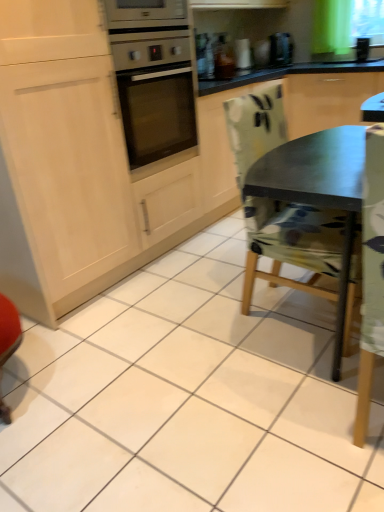
I want to click on camouflage fabric chair at center, so click(298, 199).

What is the approximate width of camouflage fabric chair at center?

camouflage fabric chair at center is 57.73 centimeters wide.

Describe the element at coordinates (242, 54) in the screenshot. The width and height of the screenshot is (384, 512). I see `metallic silver toaster at upper center` at that location.

Measure the distance between black plastic coffee machine at upper center and camera.

They are 3.31 meters apart.

At what (x,y) coordinates should I click in order to perform the action: click on camouflage fabric chair at center. Please return your answer as a coordinate pair (x, y). This screenshot has height=512, width=384. Looking at the image, I should click on (x=298, y=199).

Considering the relative sizes of camouflage fabric chair at center and metallic silver toaster at upper center in the image provided, is camouflage fabric chair at center wider than metallic silver toaster at upper center?

Correct, the width of camouflage fabric chair at center exceeds that of metallic silver toaster at upper center.

Is camouflage fabric chair at center turned away from metallic silver toaster at upper center?

No.

In the image, is camouflage fabric chair at center on the left side or the right side of metallic silver toaster at upper center?

camouflage fabric chair at center is to the right of metallic silver toaster at upper center.

Considering the relative sizes of black plastic coffee machine at upper center and metallic silver toaster at upper center in the image provided, is black plastic coffee machine at upper center thinner than metallic silver toaster at upper center?

No, black plastic coffee machine at upper center is not thinner than metallic silver toaster at upper center.

Find the location of `coffee machine located on the right of metallic silver toaster at upper center`. coffee machine located on the right of metallic silver toaster at upper center is located at coordinates (281, 49).

From a real-world perspective, which object stands above the other?

metallic silver toaster at upper center.

Image resolution: width=384 pixels, height=512 pixels. I want to click on appliance above the black plastic coffee machine at upper center (from a real-world perspective), so pos(242,54).

Which is correct: metallic silver toaster at upper center is inside black plastic coffee machine at upper center, or outside of it?

metallic silver toaster at upper center lies outside black plastic coffee machine at upper center.

Does metallic silver toaster at upper center touch black plastic coffee machine at upper center?

No, metallic silver toaster at upper center is not next to black plastic coffee machine at upper center.

What's the angular difference between metallic silver toaster at upper center and black plastic coffee machine at upper center's facing directions?

8.97 degrees separate the facing orientations of metallic silver toaster at upper center and black plastic coffee machine at upper center.

Does metallic silver toaster at upper center have a smaller size compared to camouflage fabric chair at center?

Correct, metallic silver toaster at upper center occupies less space than camouflage fabric chair at center.

Considering the relative positions of metallic silver toaster at upper center and camouflage fabric chair at center in the image provided, is metallic silver toaster at upper center to the right of camouflage fabric chair at center from the viewer's perspective?

No, metallic silver toaster at upper center is not to the right of camouflage fabric chair at center.

From the image's perspective, is metallic silver toaster at upper center over camouflage fabric chair at center?

Indeed, from the image's perspective, metallic silver toaster at upper center is shown above camouflage fabric chair at center.

Between point (249, 47) and point (242, 199), which one is positioned in front?

Point (242, 199)

Is point (290, 52) positioned after point (307, 154)?

Yes, point (290, 52) is farther from viewer.

Considering the relative sizes of black plastic coffee machine at upper center and camouflage fabric chair at center in the image provided, is black plastic coffee machine at upper center taller than camouflage fabric chair at center?

No.

Can you confirm if black plastic coffee machine at upper center is wider than camouflage fabric chair at center?

No, black plastic coffee machine at upper center is not wider than camouflage fabric chair at center.

Could you tell me if black plastic coffee machine at upper center is turned towards camouflage fabric chair at center?

No.

You are a GUI agent. You are given a task and a screenshot of the screen. Output one action in this format:
    pyautogui.click(x=<x>, y=<y>)
    Task: Click on the coffee machine positioned vertically above the camouflage fabric chair at center (from a real-world perspective)
    The height and width of the screenshot is (512, 384).
    Given the screenshot: What is the action you would take?
    pyautogui.click(x=281, y=49)

Can you see camouflage fabric chair at center touching black plastic coffee machine at upper center?

No, camouflage fabric chair at center is not beside black plastic coffee machine at upper center.

How much distance is there between camouflage fabric chair at center and black plastic coffee machine at upper center?

camouflage fabric chair at center is 2.11 meters from black plastic coffee machine at upper center.

Does camouflage fabric chair at center come behind black plastic coffee machine at upper center?

No, the depth of camouflage fabric chair at center is less than that of black plastic coffee machine at upper center.

Find the location of a particular element. This screenshot has width=384, height=512. appliance that is above the camouflage fabric chair at center (from a real-world perspective) is located at coordinates (242, 54).

In order to click on appliance above the black plastic coffee machine at upper center (from the image's perspective) in this screenshot , I will do `click(242, 54)`.

Based on their spatial positions, is metallic silver toaster at upper center or black plastic coffee machine at upper center further from camouflage fabric chair at center?

metallic silver toaster at upper center.

When comparing their distances from metallic silver toaster at upper center, does camouflage fabric chair at center or black plastic coffee machine at upper center seem further?

Among the two, camouflage fabric chair at center is located further to metallic silver toaster at upper center.

Based on their spatial positions, is black plastic coffee machine at upper center or metallic silver toaster at upper center further from camouflage fabric chair at center?

metallic silver toaster at upper center is positioned further to the anchor camouflage fabric chair at center.

Looking at the image, which one is located further to black plastic coffee machine at upper center, camouflage fabric chair at center or metallic silver toaster at upper center?

camouflage fabric chair at center.

Considering their positions, is metallic silver toaster at upper center positioned further to black plastic coffee machine at upper center than camouflage fabric chair at center?

Based on the image, camouflage fabric chair at center appears to be further to black plastic coffee machine at upper center.

Estimate the real-world distances between objects in this image. Which object is further from metallic silver toaster at upper center, black plastic coffee machine at upper center or camouflage fabric chair at center?

The object further to metallic silver toaster at upper center is camouflage fabric chair at center.

Find the location of a particular element. This screenshot has width=384, height=512. coffee machine between camouflage fabric chair at center and metallic silver toaster at upper center from front to back is located at coordinates (281, 49).